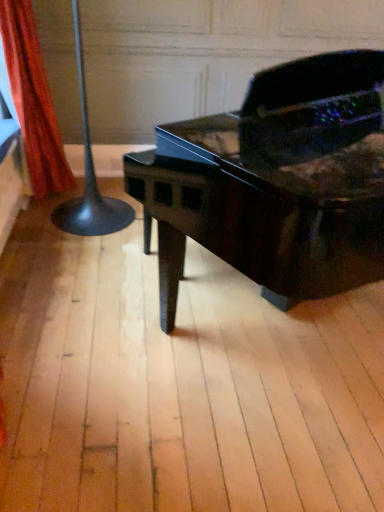
Describe the element at coordinates (33, 100) in the screenshot. I see `orange fabric curtain at left` at that location.

I want to click on orange fabric curtain at left, so click(33, 100).

Describe the element at coordinates (275, 182) in the screenshot. The height and width of the screenshot is (512, 384). I see `glossy black piano at center` at that location.

At what (x,y) coordinates should I click in order to perform the action: click on glossy black piano at center. Please return your answer as a coordinate pair (x, y). The height and width of the screenshot is (512, 384). Looking at the image, I should click on (275, 182).

In order to click on orange fabric curtain at left in this screenshot , I will do `click(33, 100)`.

Considering the positions of objects glossy black piano at center and orange fabric curtain at left in the image provided, who is more to the left, glossy black piano at center or orange fabric curtain at left?

Positioned to the left is orange fabric curtain at left.

Who is more distant, glossy black piano at center or orange fabric curtain at left?

Positioned behind is orange fabric curtain at left.

Considering the points (316, 67) and (13, 52), which point is behind, point (316, 67) or point (13, 52)?

The point (13, 52) is behind.

From the image's perspective, is glossy black piano at center positioned above or below orange fabric curtain at left?

Based on their image positions, glossy black piano at center is located beneath orange fabric curtain at left.

From a real-world perspective, which object rests below the other?

glossy black piano at center is physically lower.

Which object is wider, glossy black piano at center or orange fabric curtain at left?

Wider between the two is glossy black piano at center.

Can you confirm if glossy black piano at center is shorter than orange fabric curtain at left?

No, glossy black piano at center is not shorter than orange fabric curtain at left.

Is glossy black piano at center bigger or smaller than orange fabric curtain at left?

In the image, glossy black piano at center appears to be larger than orange fabric curtain at left.

Could orange fabric curtain at left be considered to be inside glossy black piano at center?

No, glossy black piano at center does not contain orange fabric curtain at left.

Would you say glossy black piano at center is a long distance from orange fabric curtain at left?

glossy black piano at center is far away from orange fabric curtain at left.

Is glossy black piano at center looking in the opposite direction of orange fabric curtain at left?

Yes, glossy black piano at center's orientation is away from orange fabric curtain at left.

What's the angular difference between glossy black piano at center and orange fabric curtain at left's facing directions?

58 degrees separate the facing orientations of glossy black piano at center and orange fabric curtain at left.

How much distance is there between glossy black piano at center and orange fabric curtain at left?

glossy black piano at center and orange fabric curtain at left are 1.34 meters apart.

Identify the location of curtain that appears above the glossy black piano at center (from the image's perspective). (33, 100).

From the picture: Does orange fabric curtain at left appear on the right side of glossy black piano at center?

Incorrect, orange fabric curtain at left is not on the right side of glossy black piano at center.

Does orange fabric curtain at left lie behind glossy black piano at center?

Yes, the depth of orange fabric curtain at left is greater than that of glossy black piano at center.

Is point (24, 120) less distant than point (292, 76)?

No, (24, 120) is behind (292, 76).

From the image's perspective, who appears lower, orange fabric curtain at left or glossy black piano at center?

glossy black piano at center.

From a real-world perspective, which object rests below the other?

glossy black piano at center is physically lower.

Between orange fabric curtain at left and glossy black piano at center, which one has smaller width?

Thinner between the two is orange fabric curtain at left.

Considering the sizes of objects orange fabric curtain at left and glossy black piano at center in the image provided, who is shorter, orange fabric curtain at left or glossy black piano at center?

orange fabric curtain at left.

Who is smaller, orange fabric curtain at left or glossy black piano at center?

With smaller size is orange fabric curtain at left.

Is orange fabric curtain at left outside of glossy black piano at center?

Indeed, orange fabric curtain at left is completely outside glossy black piano at center.

Are orange fabric curtain at left and glossy black piano at center far apart?

Yes, orange fabric curtain at left and glossy black piano at center are quite far apart.

Is orange fabric curtain at left facing towards glossy black piano at center?

No, orange fabric curtain at left is not aimed at glossy black piano at center.

How many degrees apart are the facing directions of orange fabric curtain at left and glossy black piano at center?

The facing directions of orange fabric curtain at left and glossy black piano at center are 58 degrees apart.

Measure the distance between orange fabric curtain at left and glossy black piano at center.

orange fabric curtain at left and glossy black piano at center are 1.34 meters apart from each other.

Locate an element on the screen. curtain that appears on the left of glossy black piano at center is located at coordinates (33, 100).

What are the coordinates of `curtain lying behind the glossy black piano at center` in the screenshot? It's located at (33, 100).

Find the location of `piano located in front of the orange fabric curtain at left`. piano located in front of the orange fabric curtain at left is located at coordinates (275, 182).